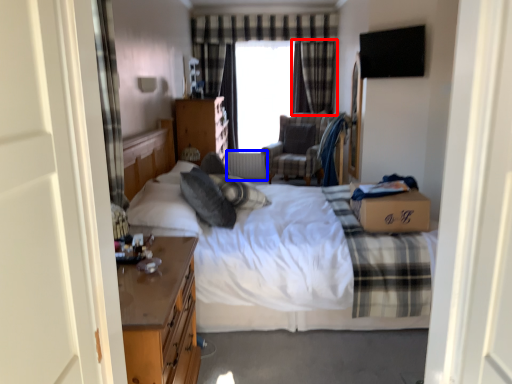
Question: Among these objects, which one is farthest to the camera, curtain (highlighted by a red box) or radiator (highlighted by a blue box)?

Choices:
 (A) curtain
 (B) radiator

Answer: (B)